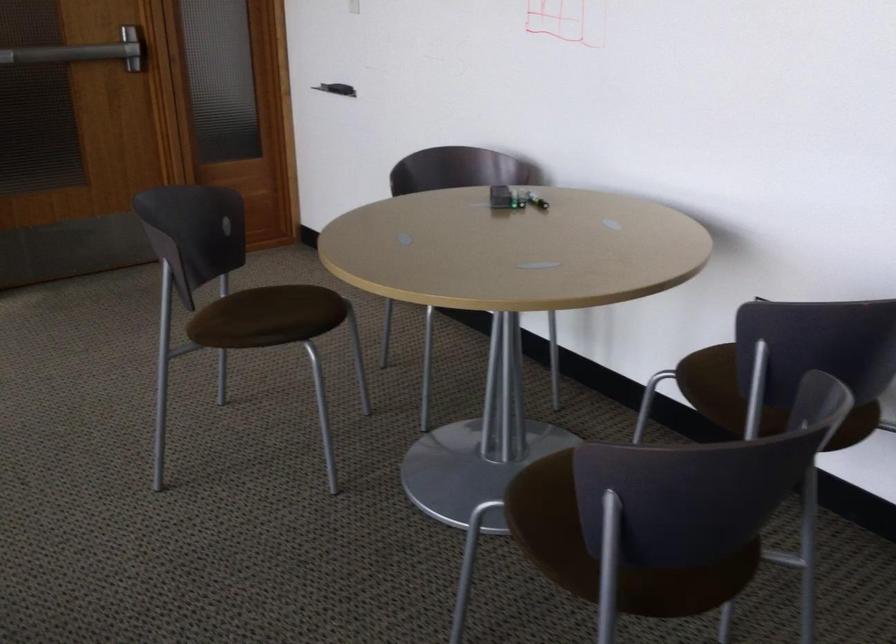
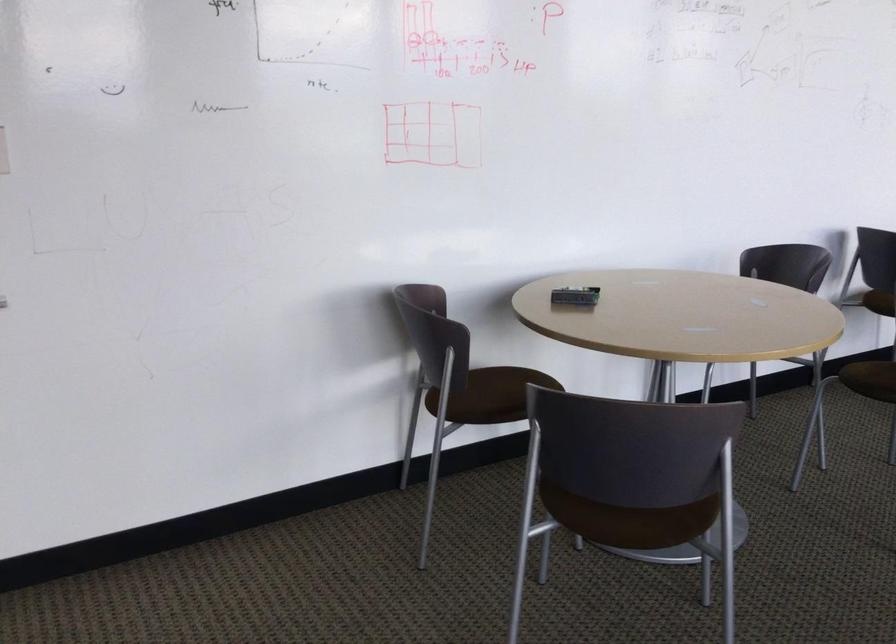
Question: I am providing you with two images of the same scene from different viewpoints. Please identify which objects are invisible in image2.

Choices:
 (A) chair sitting surface
 (B) brown chair sitting surface
 (C) maroon sofa armrest
 (D) whiteboard eraser

Answer: (B)